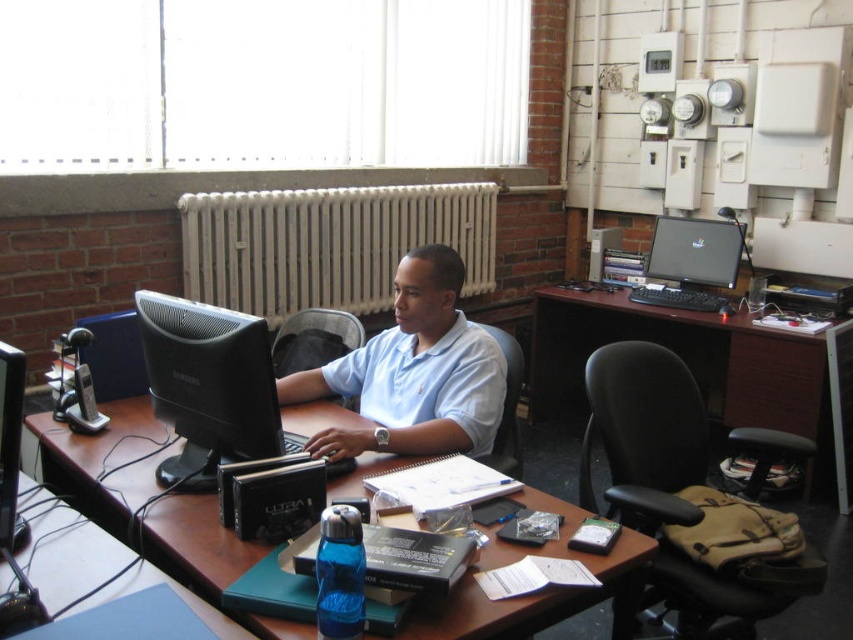
Is white metal radiator at center to the right of light blue cotton shirt at center from the viewer's perspective?

No, white metal radiator at center is not to the right of light blue cotton shirt at center.

Is point (392, 188) closer to camera compared to point (355, 444)?

No, it is behind (355, 444).

You are a GUI agent. You are given a task and a screenshot of the screen. Output one action in this format:
    pyautogui.click(x=<x>, y=<y>)
    Task: Click on the white metal radiator at center
    This screenshot has width=853, height=640.
    Given the screenshot: What is the action you would take?
    pyautogui.click(x=328, y=243)

Between white metal radiator at center and satin black monitor at center, which one is positioned higher?

white metal radiator at center

Between point (347, 253) and point (178, 355), which one is positioned in front?

Point (178, 355) is more forward.

What do you see at coordinates (328, 243) in the screenshot?
I see `white metal radiator at center` at bounding box center [328, 243].

Find the location of a particular element. The height and width of the screenshot is (640, 853). white metal radiator at center is located at coordinates (328, 243).

Can you confirm if light blue cotton shirt at center is taller than matte black monitor at upper right?

Indeed, light blue cotton shirt at center has a greater height compared to matte black monitor at upper right.

Which is below, light blue cotton shirt at center or matte black monitor at upper right?

Positioned lower is light blue cotton shirt at center.

Between point (317, 372) and point (648, 250), which one is positioned in front?

Point (317, 372) is in front.

Find the location of `light blue cotton shirt at center`. light blue cotton shirt at center is located at coordinates (413, 372).